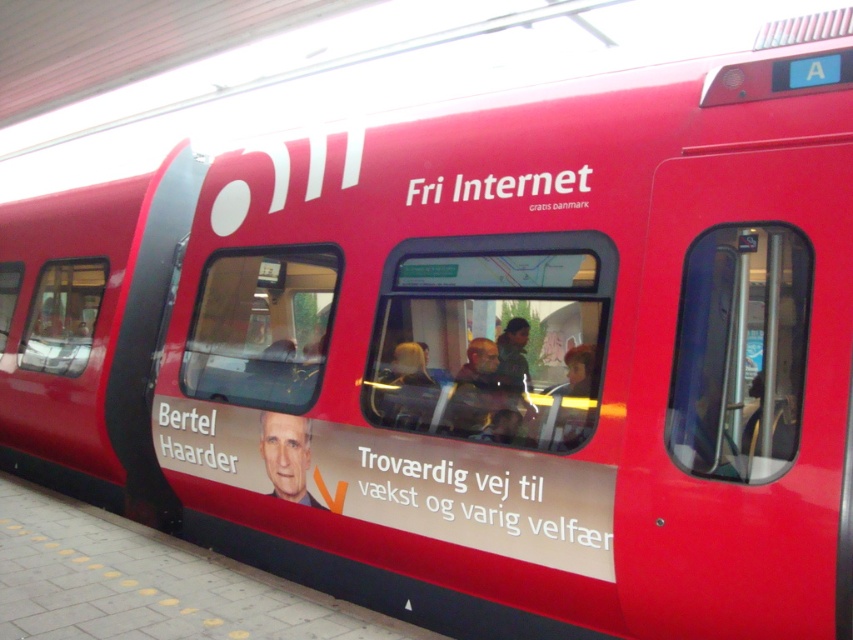
Is point (492, 362) positioned in front of point (550, 440)?

No, it is behind (550, 440).

Is matte black jacket at center above smooth brown hair at center?

Yes.

This screenshot has width=853, height=640. What do you see at coordinates (489, 388) in the screenshot? I see `matte black jacket at center` at bounding box center [489, 388].

Identify the location of matte black jacket at center. The image size is (853, 640). (489, 388).

Does point (589, 378) lie in front of point (527, 371)?

Yes, point (589, 378) is in front of point (527, 371).

Is point (589, 408) more distant than point (515, 346)?

No, (589, 408) is closer to viewer.

Identify the location of smooth brown hair at center. (569, 403).

Does matte black jacket at center have a lesser width compared to green fabric jacket at center?

Incorrect, matte black jacket at center's width is not less than green fabric jacket at center's.

Can you confirm if matte black jacket at center is positioned to the left of green fabric jacket at center?

Yes, matte black jacket at center is to the left of green fabric jacket at center.

Where is `matte black jacket at center`? matte black jacket at center is located at coordinates (489, 388).